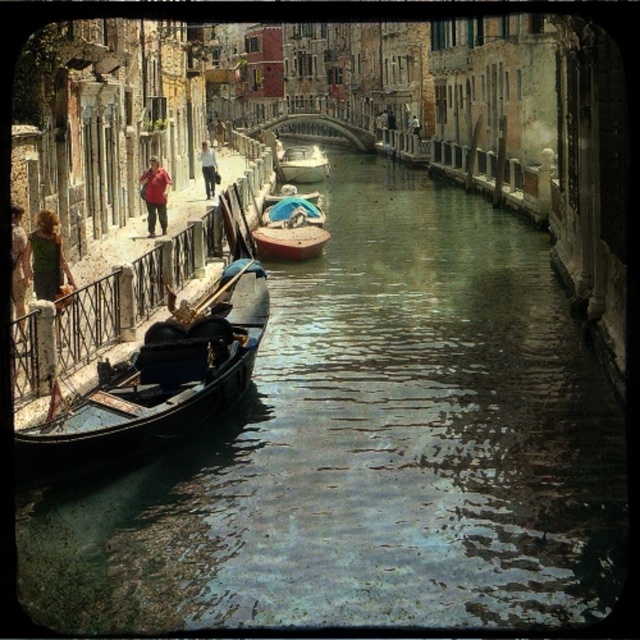
You are a tourist standing on the canal bridge and see the red cotton shirt at left and the light brown leather jacket at upper left. Which clothing item is nearer to you?

The red cotton shirt at left is closer to the viewer than the light brown leather jacket at upper left.

You are standing on the right side of the canal and want to board the black polished gondola at left. Which direction should you walk relative to the red cotton shirt at left to reach the gondola?

You should walk to the right of the red cotton shirt at left to reach the black polished gondola at left because the gondola is positioned to the right of the shirt.

You are standing at the point with coordinates (19, 266) in the canal scene. What is the color of the fabric at that location?

The point at (19, 266) is on the green fabric dress at left, so the color is green.